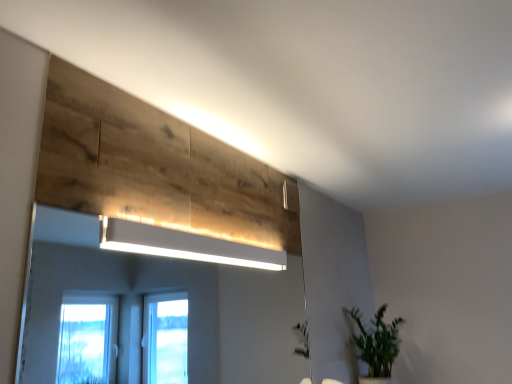
Question: Based on their sizes in the image, would you say green leafy plant at lower right is bigger or smaller than white matte rectangular light at upper center?

Choices:
 (A) small
 (B) big

Answer: (B)

Question: Considering the relative positions of green leafy plant at lower right and white matte rectangular light at upper center in the image provided, is green leafy plant at lower right to the left or to the right of white matte rectangular light at upper center?

Choices:
 (A) right
 (B) left

Answer: (A)

Question: Estimate the real-world distances between objects in this image. Which object is closer to the white glossy mirror at upper center?

Choices:
 (A) white matte rectangular light at upper center
 (B) green leafy plant at lower right

Answer: (B)

Question: Which is nearer to the green leafy plant at lower right?

Choices:
 (A) white matte rectangular light at upper center
 (B) white glossy mirror at upper center

Answer: (A)